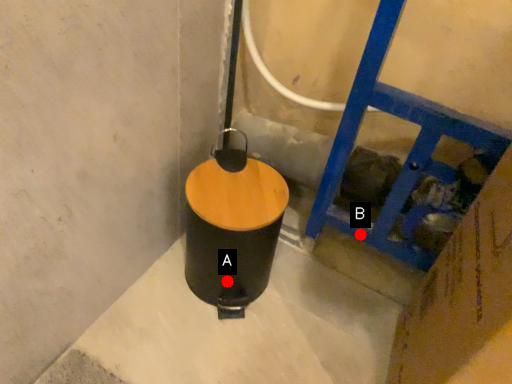
Question: Two points are circled on the image, labeled by A and B beside each circle. Which point is farther from the camera taking this photo?

Choices:
 (A) A is further
 (B) B is further

Answer: (B)